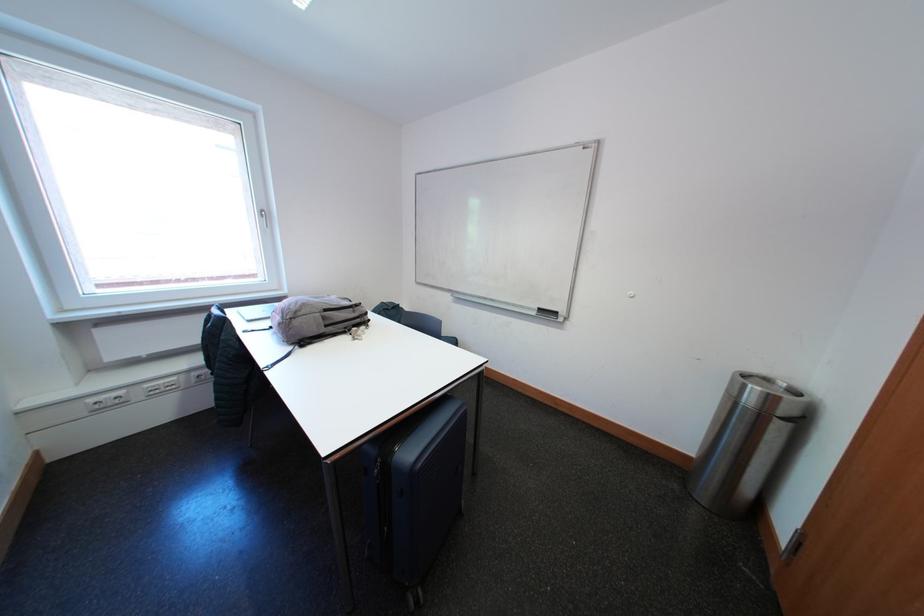
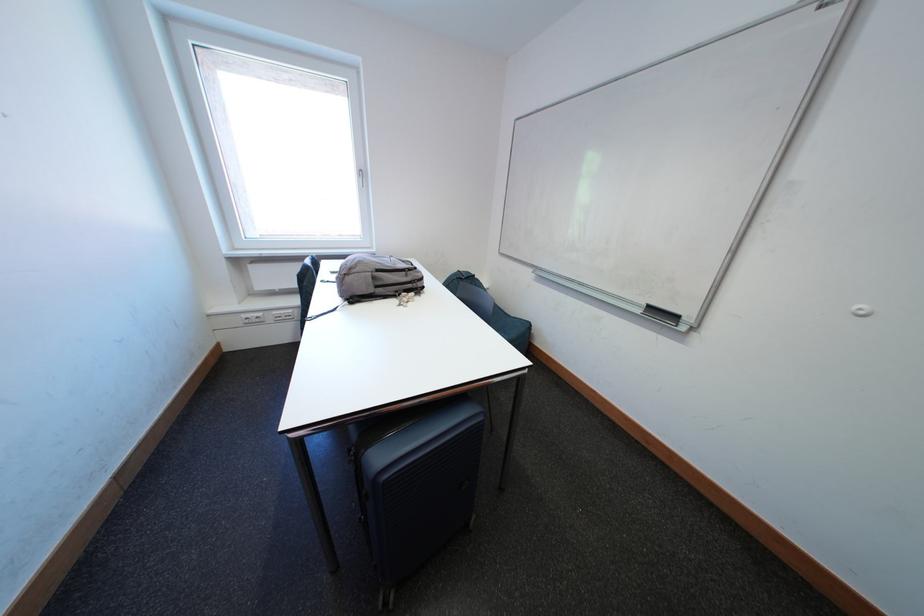
The images are taken continuously from a first-person perspective. In which direction are you moving?

The movement direction of the cameraman is right, forward.